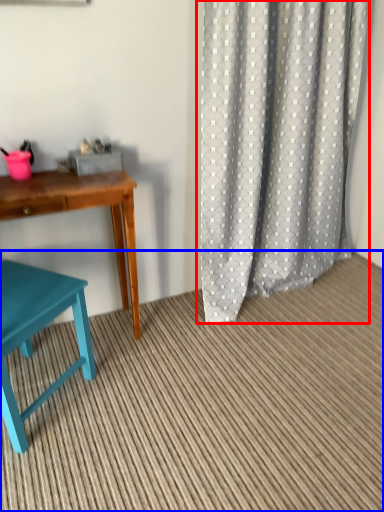
Question: Which object is further to the camera taking this photo, curtain (highlighted by a red box) or plain (highlighted by a blue box)?

Choices:
 (A) curtain
 (B) plain

Answer: (A)